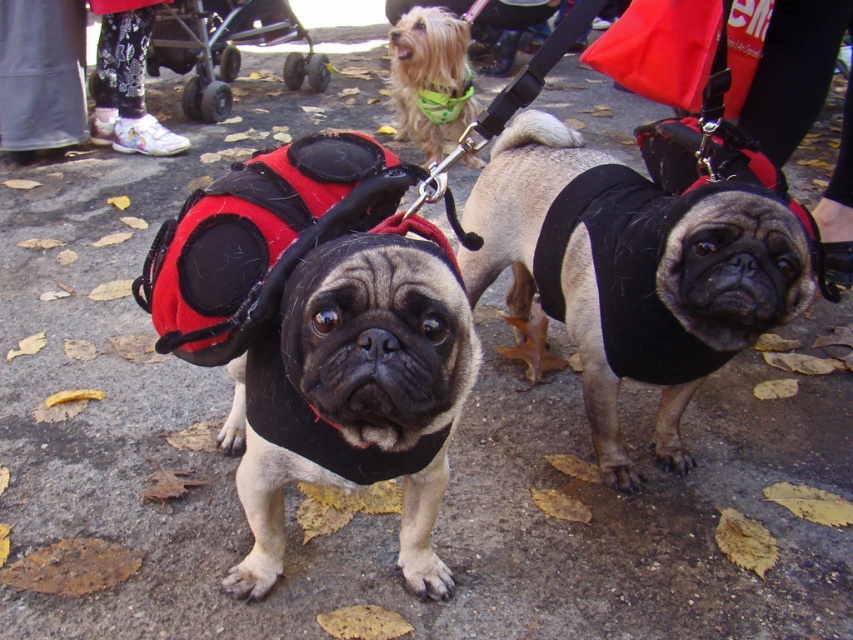
Question: Among these points, which one is farthest from the camera?

Choices:
 (A) (518, 248)
 (B) (309, 385)
 (C) (318, 52)

Answer: (C)

Question: Is the position of black fleece vest at center less distant than that of black plastic baby carriage at upper left?

Choices:
 (A) yes
 (B) no

Answer: (A)

Question: Does black soft vest at center appear over shiny green bandana at upper center?

Choices:
 (A) yes
 (B) no

Answer: (B)

Question: Does black soft vest at center lie in front of black plastic baby carriage at upper left?

Choices:
 (A) yes
 (B) no

Answer: (A)

Question: Which of these objects is positioned farthest from the shiny green bandana at upper center?

Choices:
 (A) black soft vest at center
 (B) black plastic baby carriage at upper left
 (C) black fleece vest at center

Answer: (C)

Question: Which is farther from the black soft vest at center?

Choices:
 (A) black fleece vest at center
 (B) shiny green bandana at upper center

Answer: (B)